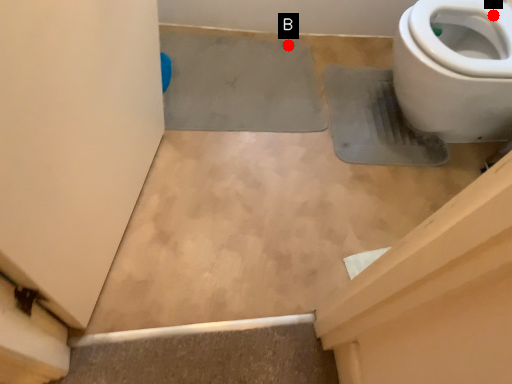
Question: Two points are circled on the image, labeled by A and B beside each circle. Which point appears farthest from the camera in this image?

Choices:
 (A) A is further
 (B) B is further

Answer: (B)